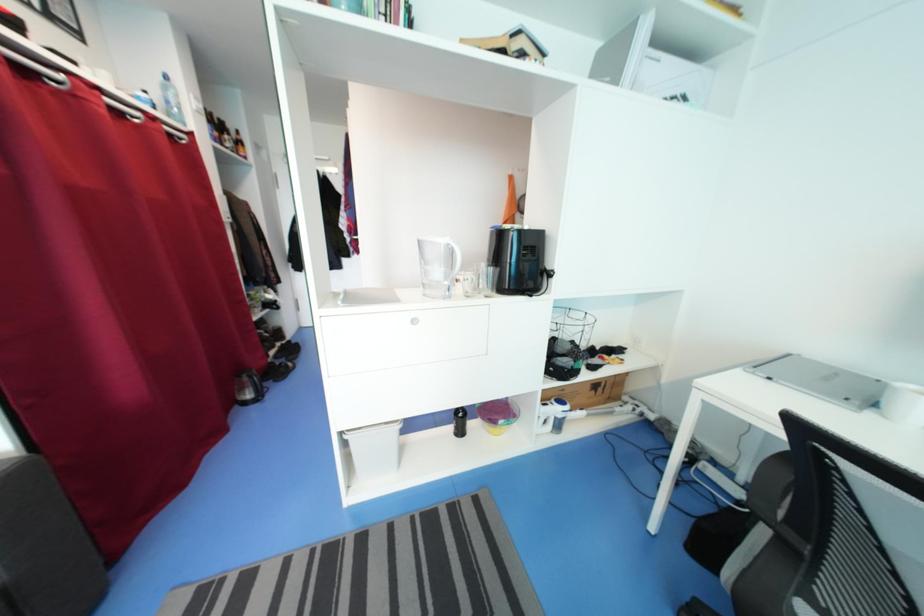
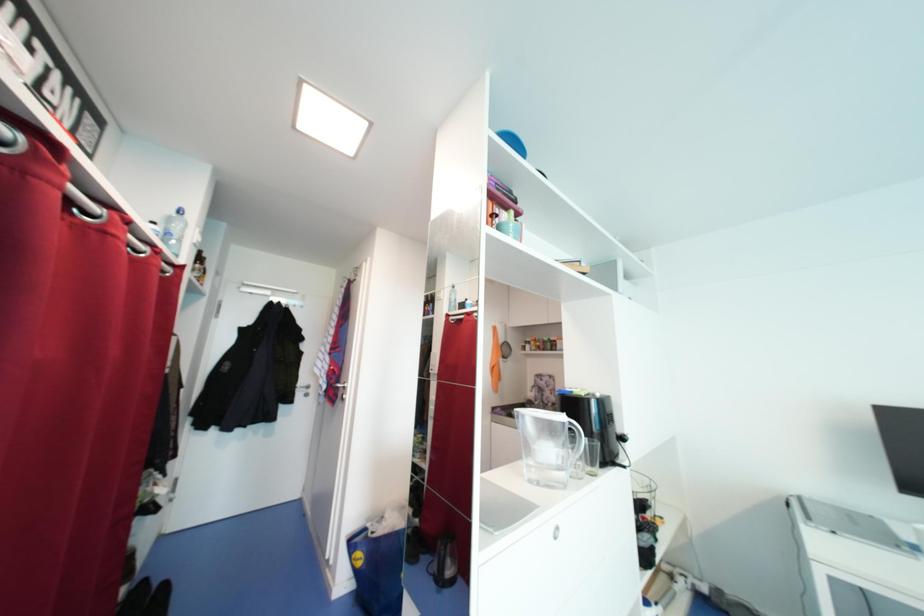
How did the camera likely rotate?

The camera rotated toward right-up.